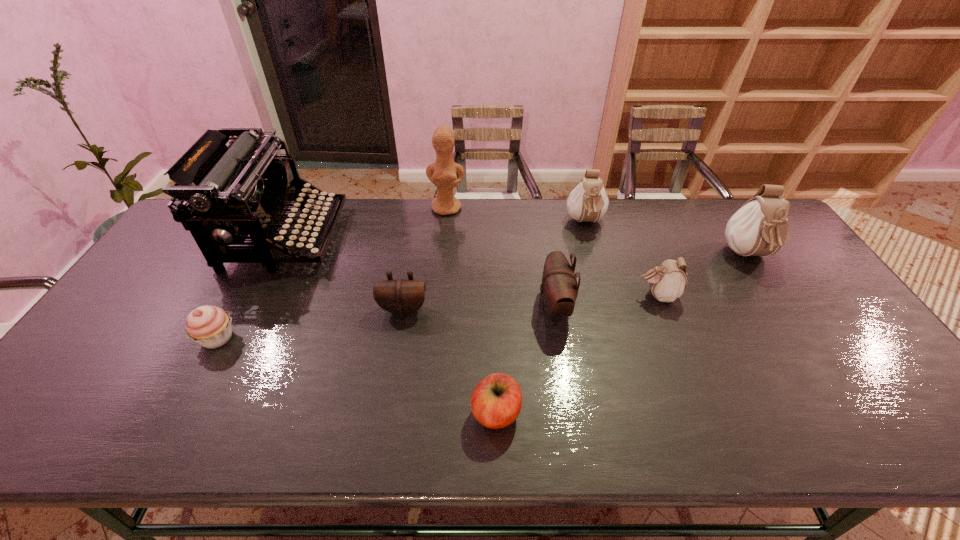
Identify the location of free area in between the smallest white pouch and the smaller brown pouch. The width and height of the screenshot is (960, 540). (530, 302).

Where is `vacant area that lies between the second white pouch from right to left and the figurine`? vacant area that lies between the second white pouch from right to left and the figurine is located at coordinates (552, 252).

This screenshot has height=540, width=960. What are the coordinates of `free spot between the figurine and the nearest object` in the screenshot? It's located at (471, 310).

This screenshot has height=540, width=960. Identify the location of vacant point located between the apple and the seventh shortest object. (622, 334).

At what (x,y) coordinates should I click in order to perform the action: click on unoccupied position between the second biggest white pouch and the second white pouch from left to right. Please return your answer as a coordinate pair (x, y). Looking at the image, I should click on (621, 259).

In order to click on the third closest object to the cupcake in this screenshot , I will do `click(496, 401)`.

Select which object is the closest to the typewriter. Please provide its 2D coordinates. Your answer should be formatted as a tuple, i.e. [(x, y)], where the tuple contains the x and y coordinates of a point satisfying the conditions above.

[(210, 326)]

Select which pouch is the third closest to the cupcake. Please provide its 2D coordinates. Your answer should be formatted as a tuple, i.e. [(x, y)], where the tuple contains the x and y coordinates of a point satisfying the conditions above.

[(588, 202)]

Select which pouch appears as the closest to the leftmost white pouch. Please provide its 2D coordinates. Your answer should be formatted as a tuple, i.e. [(x, y)], where the tuple contains the x and y coordinates of a point satisfying the conditions above.

[(668, 281)]

Choose which white pouch is the second nearest neighbor to the tallest pouch. Please provide its 2D coordinates. Your answer should be formatted as a tuple, i.e. [(x, y)], where the tuple contains the x and y coordinates of a point satisfying the conditions above.

[(588, 202)]